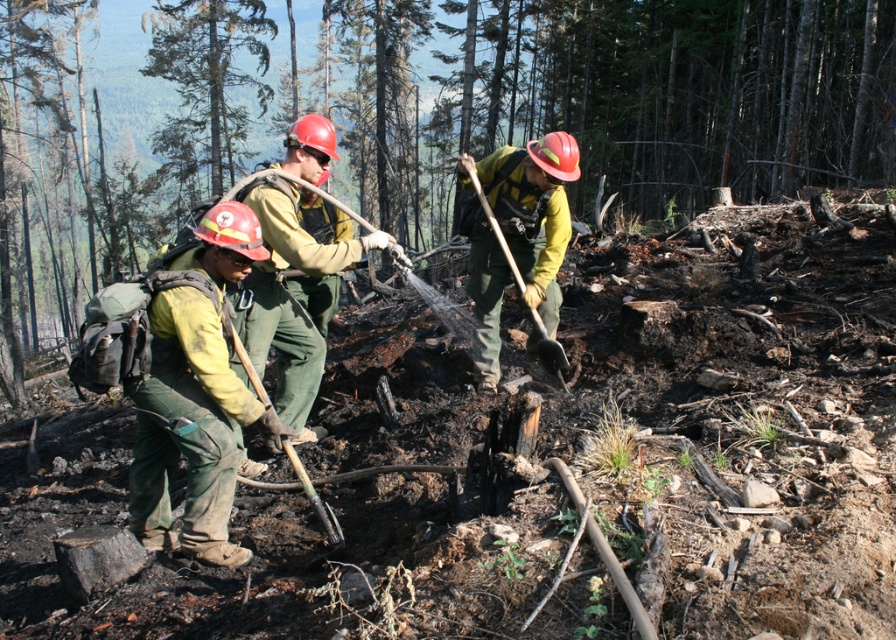
Question: Is charcoal ash stump at center behind green canvas pants at center?

Choices:
 (A) no
 (B) yes

Answer: (B)

Question: Where is charcoal ash stump at center located in relation to green canvas pants at center in the image?

Choices:
 (A) right
 (B) left

Answer: (B)

Question: Which point is closer to the camera?

Choices:
 (A) (162, 353)
 (B) (171, 124)

Answer: (A)

Question: Which object appears farthest from the camera in this image?

Choices:
 (A) green wooden shovel at lower center
 (B) charcoal ash stump at center

Answer: (B)

Question: Among these points, which one is farthest from the camera?

Choices:
 (A) (214, 515)
 (B) (334, 545)
 (C) (300, 232)

Answer: (C)

Question: Is matte green uniform at center positioned behind wooden shovel at center?

Choices:
 (A) yes
 (B) no

Answer: (B)